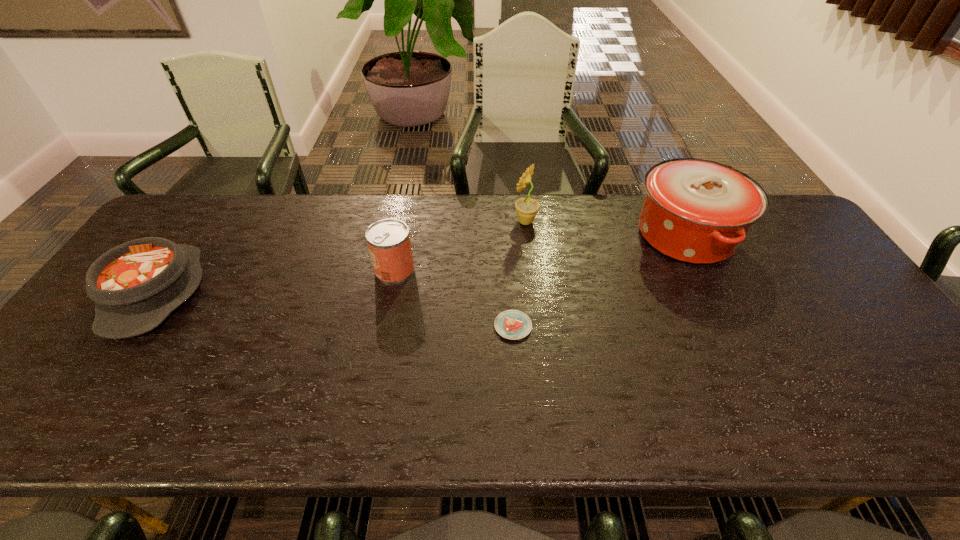
Identify the location of free space that satisfies the following two spatial constraints: 1. on the face of the rightmost object; 2. on the right side of the sunflower. (527, 235).

At what (x,y) coordinates should I click in order to perform the action: click on vacant space that satisfies the following two spatial constraints: 1. on the face of the sunflower; 2. on the left side of the right casserole. Please return your answer as a coordinate pair (x, y). This screenshot has width=960, height=540. Looking at the image, I should click on (527, 235).

This screenshot has width=960, height=540. What are the coordinates of `free space that satisfies the following two spatial constraints: 1. on the back side of the can; 2. on the right side of the rightmost object` in the screenshot? It's located at (401, 235).